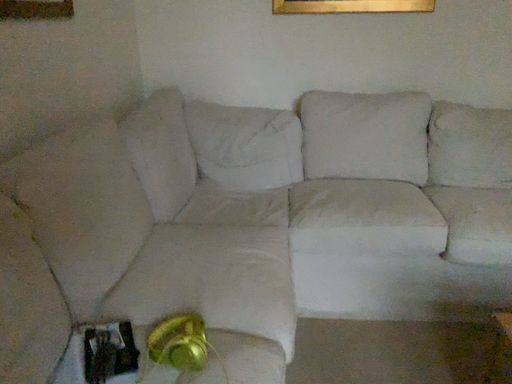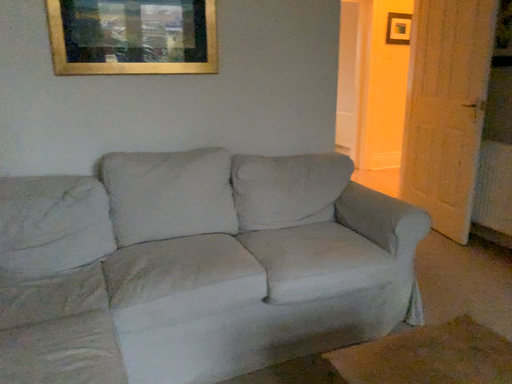
Question: How did the camera likely rotate when shooting the video?

Choices:
 (A) rotated right
 (B) rotated left

Answer: (A)